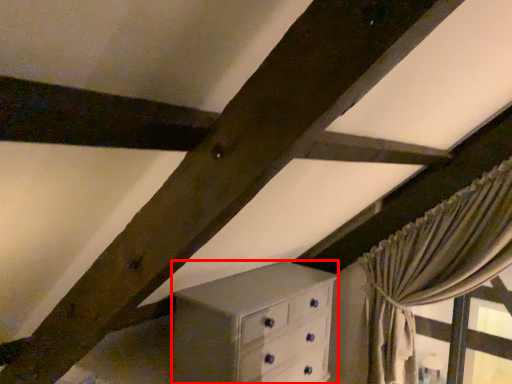
Question: From the image, what is the correct spatial relationship of chest of drawers (annotated by the red box) in relation to curtain?

Choices:
 (A) left
 (B) right

Answer: (A)